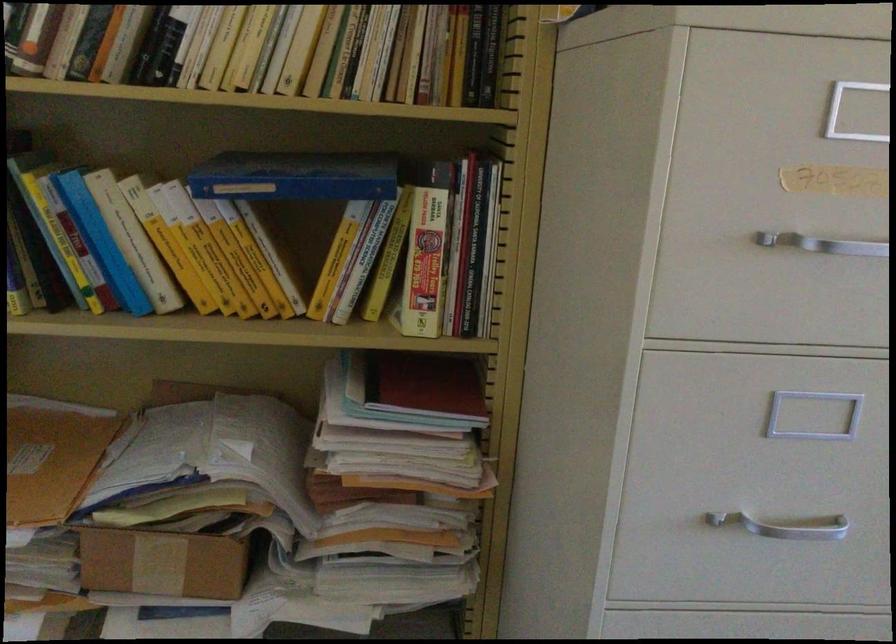
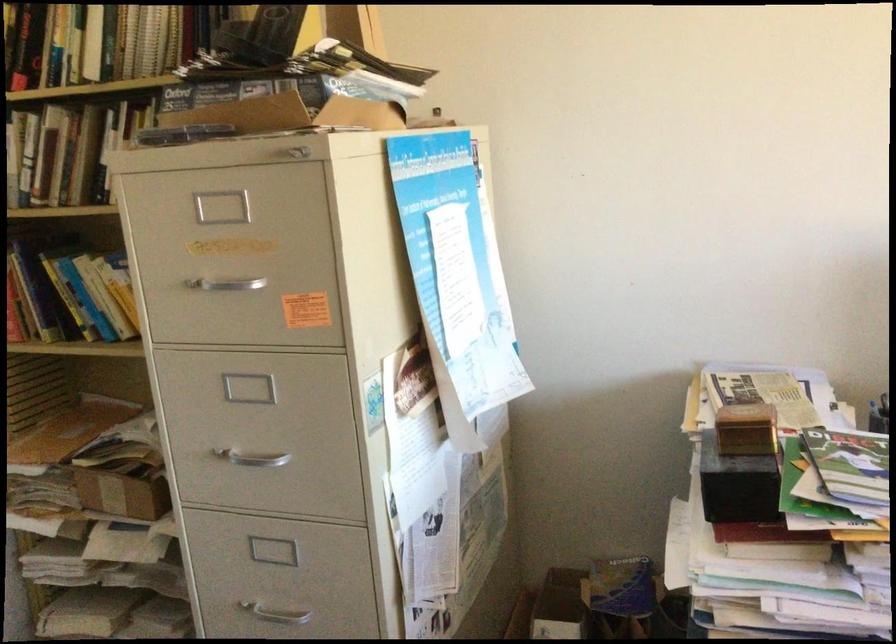
Question: I am providing you with two images of the same scene from different viewpoints. After the viewpoint changes to image2, which objects are now occluded?

Choices:
 (A) book
 (B) metal drawer handle
 (C) blue book box
 (D) metal soap dish

Answer: (C)